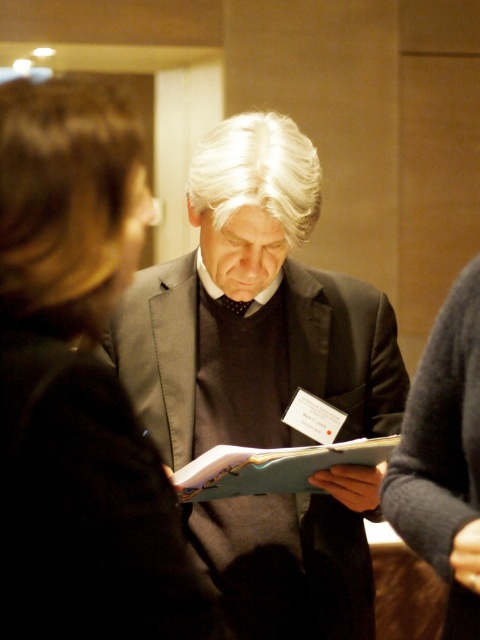
You are organizing a photo shoot and need to arrange two outfits on a rack. The matte black suit at center and the dark brown leather jacket at left are available. If you want to place the taller item higher on the rack, which one should you put higher?

The matte black suit at center has a greater height compared to the dark brown leather jacket at left, so you should place the matte black suit at center higher on the rack.

You are a photographer at this event and need to capture a clear shot of the name tag on the matte black suit at center. However, the blue matte folder at center is blocking your view. Can you adjust your angle to see the name tag without moving the folder?

The matte black suit at center is located above the blue matte folder at center, so adjusting your angle slightly upward should allow you to see the name tag without moving the folder.

You are organizing a photo shoot and need to position two models in a similar setup. The first model is wearing a matte black suit at center and the second is wearing a dark brown leather jacket at left. To ensure the photo maintains the same spatial relationship as the original image, how far apart should you place the two models?

The two models should be placed 79.72 centimeters apart to maintain the same spatial relationship as the original image.